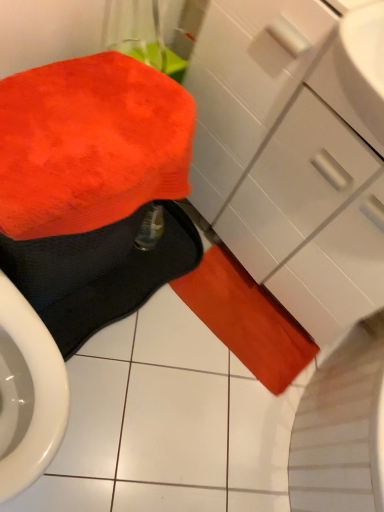
Measure the distance between fluffy orange towel at lower left, which is counted as the 3th bath towel, starting from the back, and camera.

A distance of 26.92 inches exists between fluffy orange towel at lower left, which is counted as the 3th bath towel, starting from the back, and camera.

Describe the element at coordinates (90, 144) in the screenshot. I see `fluffy orange towel at lower left, which is counted as the 3th bath towel, starting from the back` at that location.

Describe the element at coordinates (98, 273) in the screenshot. Image resolution: width=384 pixels, height=512 pixels. I see `orange fuzzy bath towel at lower center, which is counted as the second bath towel, starting from the front` at that location.

Find the location of a particular element. The width and height of the screenshot is (384, 512). orange suede bath towel at lower center, the first bath towel in the back-to-front sequence is located at coordinates (246, 319).

Is orange fuzzy bath towel at lower center, which is counted as the second bath towel, starting from the front, far from orange suede bath towel at lower center, which is the 3th bath towel from front to back?

They are positioned close to each other.

Between point (79, 310) and point (212, 297), which one is positioned in front?

The point (79, 310) is closer to the camera.

Could you tell me if orange fuzzy bath towel at lower center, which is counted as the second bath towel, starting from the front, is facing orange suede bath towel at lower center, the first bath towel in the back-to-front sequence?

Yes.

Locate an element on the screen. The height and width of the screenshot is (512, 384). bath towel above the orange fuzzy bath towel at lower center, the 2th bath towel when ordered from back to front (from the image's perspective) is located at coordinates (90, 144).

From the image's perspective, would you say fluffy orange towel at lower left, which is counted as the 3th bath towel, starting from the back, is shown under orange fuzzy bath towel at lower center, the 2th bath towel when ordered from back to front?

Incorrect, from the image's perspective, fluffy orange towel at lower left, which is counted as the 3th bath towel, starting from the back, is higher than orange fuzzy bath towel at lower center, the 2th bath towel when ordered from back to front.

Between fluffy orange towel at lower left, which is the first bath towel in front-to-back order, and orange fuzzy bath towel at lower center, the 2th bath towel when ordered from back to front, which one appears on the right side from the viewer's perspective?

Positioned to the right is orange fuzzy bath towel at lower center, the 2th bath towel when ordered from back to front.

Based on their sizes in the image, would you say fluffy orange towel at lower left, which is counted as the 3th bath towel, starting from the back, is bigger or smaller than orange fuzzy bath towel at lower center, which is counted as the second bath towel, starting from the front?

In the image, fluffy orange towel at lower left, which is counted as the 3th bath towel, starting from the back, appears to be larger than orange fuzzy bath towel at lower center, which is counted as the second bath towel, starting from the front.

From a real-world perspective, does matte white drawer at center-right sit lower than orange suede bath towel at lower center, which is the 3th bath towel from front to back?

Actually, matte white drawer at center-right is physically above orange suede bath towel at lower center, which is the 3th bath towel from front to back, in the real world.

Is matte white drawer at center-right inside the boundaries of orange suede bath towel at lower center, which is the 3th bath towel from front to back, or outside?

matte white drawer at center-right is not inside orange suede bath towel at lower center, which is the 3th bath towel from front to back, it's outside.

Which of these two, matte white drawer at center-right or orange suede bath towel at lower center, which is the 3th bath towel from front to back, is bigger?

matte white drawer at center-right.

From their relative heights in the image, would you say matte white drawer at center-right is taller or shorter than orange suede bath towel at lower center, the first bath towel in the back-to-front sequence?

matte white drawer at center-right is taller than orange suede bath towel at lower center, the first bath towel in the back-to-front sequence.

From the image's perspective, is orange suede bath towel at lower center, the first bath towel in the back-to-front sequence, above or below orange fuzzy bath towel at lower center, the 2th bath towel when ordered from back to front?

From the image's perspective, orange suede bath towel at lower center, the first bath towel in the back-to-front sequence, appears below orange fuzzy bath towel at lower center, the 2th bath towel when ordered from back to front.

How many degrees apart are the facing directions of orange suede bath towel at lower center, which is the 3th bath towel from front to back, and orange fuzzy bath towel at lower center, which is counted as the second bath towel, starting from the front?

orange suede bath towel at lower center, which is the 3th bath towel from front to back, and orange fuzzy bath towel at lower center, which is counted as the second bath towel, starting from the front, are facing 87.7 degrees away from each other.

In the scene shown: Would you consider orange suede bath towel at lower center, which is the 3th bath towel from front to back, to be distant from orange fuzzy bath towel at lower center, which is counted as the second bath towel, starting from the front?

No, there isn't a large distance between orange suede bath towel at lower center, which is the 3th bath towel from front to back, and orange fuzzy bath towel at lower center, which is counted as the second bath towel, starting from the front.

Considering the sizes of objects orange suede bath towel at lower center, which is the 3th bath towel from front to back, and orange fuzzy bath towel at lower center, the 2th bath towel when ordered from back to front, in the image provided, who is taller, orange suede bath towel at lower center, which is the 3th bath towel from front to back, or orange fuzzy bath towel at lower center, the 2th bath towel when ordered from back to front,?

orange suede bath towel at lower center, which is the 3th bath towel from front to back, is taller.

Considering the relative sizes of matte white drawer at center-right and fluffy orange towel at lower left, which is the first bath towel in front-to-back order, in the image provided, is matte white drawer at center-right bigger than fluffy orange towel at lower left, which is the first bath towel in front-to-back order,?

Correct, matte white drawer at center-right is larger in size than fluffy orange towel at lower left, which is the first bath towel in front-to-back order.

Would you say matte white drawer at center-right is a long distance from fluffy orange towel at lower left, which is counted as the 3th bath towel, starting from the back?

matte white drawer at center-right is near fluffy orange towel at lower left, which is counted as the 3th bath towel, starting from the back, not far away.

Can you tell me how much matte white drawer at center-right and fluffy orange towel at lower left, which is the first bath towel in front-to-back order, differ in facing direction?

The facing directions of matte white drawer at center-right and fluffy orange towel at lower left, which is the first bath towel in front-to-back order, are 92.2 degrees apart.

How much distance is there between matte white drawer at center-right and fluffy orange towel at lower left, which is the first bath towel in front-to-back order?

They are 16.50 inches apart.

Can you confirm if orange fuzzy bath towel at lower center, which is counted as the second bath towel, starting from the front, is bigger than matte white drawer at center-right?

No.

Is orange fuzzy bath towel at lower center, which is counted as the second bath towel, starting from the front, far away from matte white drawer at center-right?

No, orange fuzzy bath towel at lower center, which is counted as the second bath towel, starting from the front, is in close proximity to matte white drawer at center-right.

Which is behind, orange fuzzy bath towel at lower center, the 2th bath towel when ordered from back to front, or matte white drawer at center-right?

Positioned behind is orange fuzzy bath towel at lower center, the 2th bath towel when ordered from back to front.

From a real-world perspective, is orange fuzzy bath towel at lower center, the 2th bath towel when ordered from back to front, above or below matte white drawer at center-right?

From a real-world perspective, orange fuzzy bath towel at lower center, the 2th bath towel when ordered from back to front, is physically below matte white drawer at center-right.

Considering the sizes of matte white drawer at center-right and orange fuzzy bath towel at lower center, which is counted as the second bath towel, starting from the front, in the image, is matte white drawer at center-right wider or thinner than orange fuzzy bath towel at lower center, which is counted as the second bath towel, starting from the front,?

Clearly, matte white drawer at center-right has more width compared to orange fuzzy bath towel at lower center, which is counted as the second bath towel, starting from the front.

There is a matte white drawer at center-right. Find the location of `the 2nd bath towel below it (from the image's perspective)`. the 2nd bath towel below it (from the image's perspective) is located at coordinates (98, 273).

Looking at this image, would you say matte white drawer at center-right is a long distance from orange fuzzy bath towel at lower center, the 2th bath towel when ordered from back to front?

No, matte white drawer at center-right is not far away from orange fuzzy bath towel at lower center, the 2th bath towel when ordered from back to front.

At what (x,y) coordinates should I click in order to perform the action: click on bath towel on the right side of orange fuzzy bath towel at lower center, the 2th bath towel when ordered from back to front. Please return your answer as a coordinate pair (x, y). Looking at the image, I should click on [x=246, y=319].

From the image's perspective, count 1st bath towels downward from the fluffy orange towel at lower left, which is counted as the 3th bath towel, starting from the back, and point to it. Please provide its 2D coordinates.

[(98, 273)]

Estimate the real-world distances between objects in this image. Which object is further from orange suede bath towel at lower center, which is the 3th bath towel from front to back, matte white drawer at center-right or fluffy orange towel at lower left, which is the first bath towel in front-to-back order?

fluffy orange towel at lower left, which is the first bath towel in front-to-back order, is positioned further to the anchor orange suede bath towel at lower center, which is the 3th bath towel from front to back.

Estimate the real-world distances between objects in this image. Which object is closer to orange suede bath towel at lower center, which is the 3th bath towel from front to back, matte white drawer at center-right or orange fuzzy bath towel at lower center, the 2th bath towel when ordered from back to front?

orange fuzzy bath towel at lower center, the 2th bath towel when ordered from back to front, is closer to orange suede bath towel at lower center, which is the 3th bath towel from front to back.

Looking at the image, which one is located further to fluffy orange towel at lower left, which is the first bath towel in front-to-back order, orange suede bath towel at lower center, which is the 3th bath towel from front to back, or orange fuzzy bath towel at lower center, the 2th bath towel when ordered from back to front?

orange suede bath towel at lower center, which is the 3th bath towel from front to back.

Which object lies further to the anchor point matte white drawer at center-right, orange suede bath towel at lower center, the first bath towel in the back-to-front sequence, or fluffy orange towel at lower left, which is the first bath towel in front-to-back order?

Based on the image, fluffy orange towel at lower left, which is the first bath towel in front-to-back order, appears to be further to matte white drawer at center-right.

Considering their positions, is fluffy orange towel at lower left, which is the first bath towel in front-to-back order, positioned closer to orange suede bath towel at lower center, which is the 3th bath towel from front to back, than matte white drawer at center-right?

matte white drawer at center-right.

Considering their positions, is matte white drawer at center-right positioned closer to fluffy orange towel at lower left, which is the first bath towel in front-to-back order, than orange suede bath towel at lower center, the first bath towel in the back-to-front sequence?

matte white drawer at center-right is positioned closer to the anchor fluffy orange towel at lower left, which is the first bath towel in front-to-back order.

When comparing their distances from orange suede bath towel at lower center, which is the 3th bath towel from front to back, does fluffy orange towel at lower left, which is counted as the 3th bath towel, starting from the back, or orange fuzzy bath towel at lower center, which is counted as the second bath towel, starting from the front, seem closer?

orange fuzzy bath towel at lower center, which is counted as the second bath towel, starting from the front.

Looking at the image, which one is located further to fluffy orange towel at lower left, which is counted as the 3th bath towel, starting from the back, orange suede bath towel at lower center, the first bath towel in the back-to-front sequence, or matte white drawer at center-right?

orange suede bath towel at lower center, the first bath towel in the back-to-front sequence, lies further to fluffy orange towel at lower left, which is counted as the 3th bath towel, starting from the back, than the other object.

Locate an element on the screen. drawer located between fluffy orange towel at lower left, which is the first bath towel in front-to-back order, and orange suede bath towel at lower center, which is the 3th bath towel from front to back, in the depth direction is located at coordinates (312, 220).

Image resolution: width=384 pixels, height=512 pixels. I want to click on bath towel between fluffy orange towel at lower left, which is counted as the 3th bath towel, starting from the back, and orange suede bath towel at lower center, the first bath towel in the back-to-front sequence, in the front-back direction, so click(98, 273).

Where is `bath towel positioned between matte white drawer at center-right and orange suede bath towel at lower center, which is the 3th bath towel from front to back, from near to far`? The width and height of the screenshot is (384, 512). bath towel positioned between matte white drawer at center-right and orange suede bath towel at lower center, which is the 3th bath towel from front to back, from near to far is located at coordinates (98, 273).

Identify the location of drawer between fluffy orange towel at lower left, which is the first bath towel in front-to-back order, and orange fuzzy bath towel at lower center, the 2th bath towel when ordered from back to front, from front to back. (312, 220).